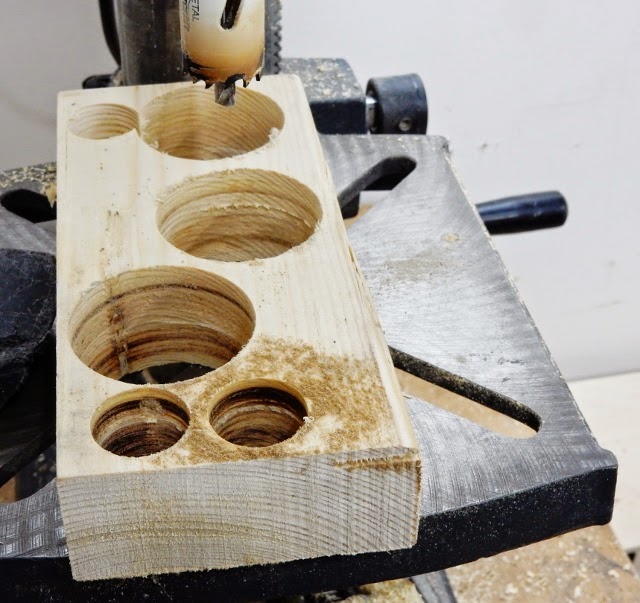
This screenshot has height=603, width=640. In order to click on floor in this screenshot , I will do `click(623, 415)`.